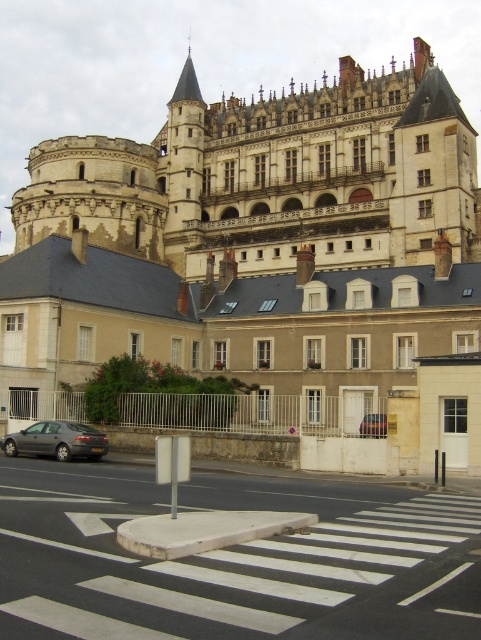
Who is positioned more to the right, dark gray metallic car at lower left or metallic silver car at center?

metallic silver car at center

From the picture: Can you confirm if dark gray metallic car at lower left is positioned above metallic silver car at center?

No.

Is point (1, 448) more distant than point (379, 420)?

No, (1, 448) is closer to viewer.

You are a GUI agent. You are given a task and a screenshot of the screen. Output one action in this format:
    pyautogui.click(x=<x>, y=<y>)
    Task: Click on the dark gray metallic car at lower left
    This screenshot has width=481, height=640.
    Given the screenshot: What is the action you would take?
    pyautogui.click(x=57, y=440)

Between stone castle at upper center and metallic silver car at center, which one appears on the left side from the viewer's perspective?

From the viewer's perspective, stone castle at upper center appears more on the left side.

This screenshot has width=481, height=640. Identify the location of stone castle at upper center. (273, 176).

At what (x,y) coordinates should I click in order to perform the action: click on stone castle at upper center. Please return your answer as a coordinate pair (x, y). Looking at the image, I should click on (273, 176).

Is white asphalt crosswalk at center above dark gray metallic car at lower left?

Actually, white asphalt crosswalk at center is below dark gray metallic car at lower left.

This screenshot has width=481, height=640. Describe the element at coordinates (232, 561) in the screenshot. I see `white asphalt crosswalk at center` at that location.

Image resolution: width=481 pixels, height=640 pixels. I want to click on white asphalt crosswalk at center, so click(x=232, y=561).